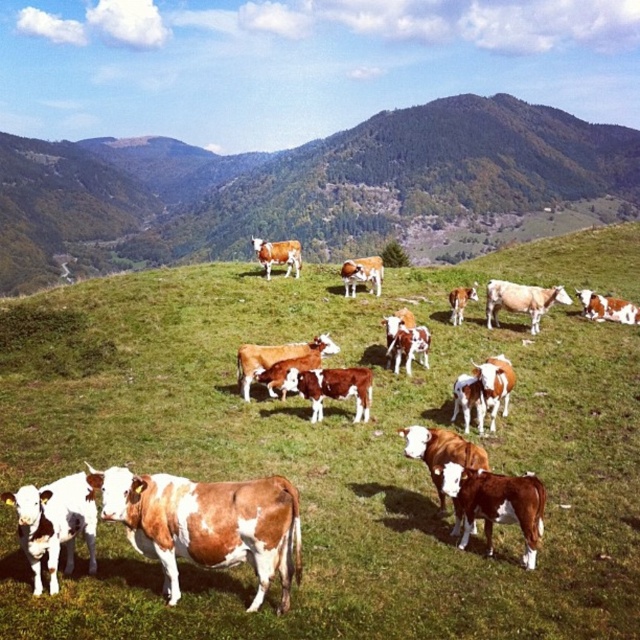
Question: Can you confirm if brown grassy hillside at center is positioned above green grassy hillside at upper center?

Choices:
 (A) yes
 (B) no

Answer: (B)

Question: Which point is farther from the camera taking this photo?

Choices:
 (A) (280, 252)
 (B) (390, 232)

Answer: (B)

Question: Is green grassy hillside at upper center further to camera compared to brown speckled cow at center?

Choices:
 (A) yes
 (B) no

Answer: (A)

Question: Which point appears farthest from the camera in this image?

Choices:
 (A) (403, 145)
 (B) (492, 605)

Answer: (A)

Question: Can you confirm if brown grassy hillside at center is thinner than green grassy hillside at upper center?

Choices:
 (A) no
 (B) yes

Answer: (B)

Question: Which object is positioned farthest from the brown speckled cow at center?

Choices:
 (A) brown grassy hillside at center
 (B) green grassy hillside at upper center

Answer: (B)